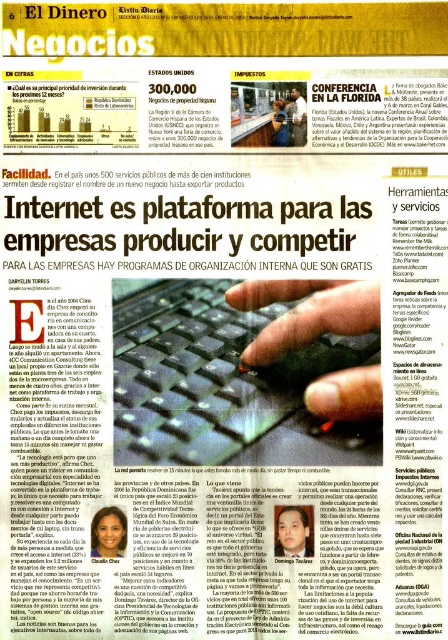
Question: Considering the real-world distances, which object is closest to the matte black pen at upper center?

Choices:
 (A) matte black pen at center
 (B) black matte keyboard at center

Answer: (A)

Question: Is dark skin face at center above matte black face at center?

Choices:
 (A) no
 (B) yes

Answer: (B)

Question: From the image, what is the correct spatial relationship of black plastic keyboard at center in relation to black matte keyboard at center?

Choices:
 (A) right
 (B) left

Answer: (B)

Question: Which object is positioned closest to the matte black pen at center?

Choices:
 (A) black plastic keyboard at center
 (B) black matte keyboard at center
 (C) matte black face at center

Answer: (B)

Question: Which object is positioned farthest from the black plastic keyboard at center?

Choices:
 (A) matte black pen at center
 (B) black matte keyboard at center

Answer: (A)

Question: Is black plastic keyboard at center wider than matte black pen at center?

Choices:
 (A) yes
 (B) no

Answer: (A)